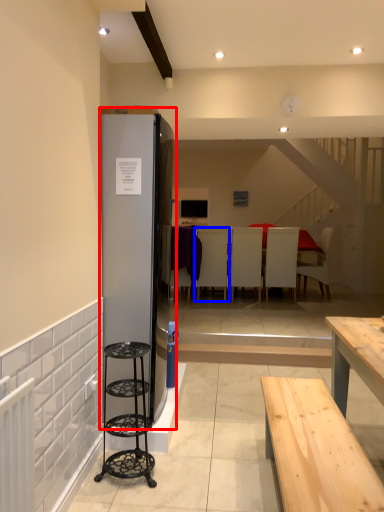
Question: Among these objects, which one is farthest to the camera, fridge (highlighted by a red box) or armchair (highlighted by a blue box)?

Choices:
 (A) fridge
 (B) armchair

Answer: (B)